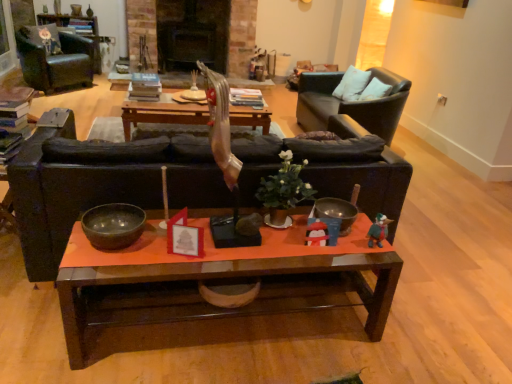
The image size is (512, 384). Identify the location of free space in front of metallic silver bowl at center, which is counted as the first bowl, starting from the back. (333, 250).